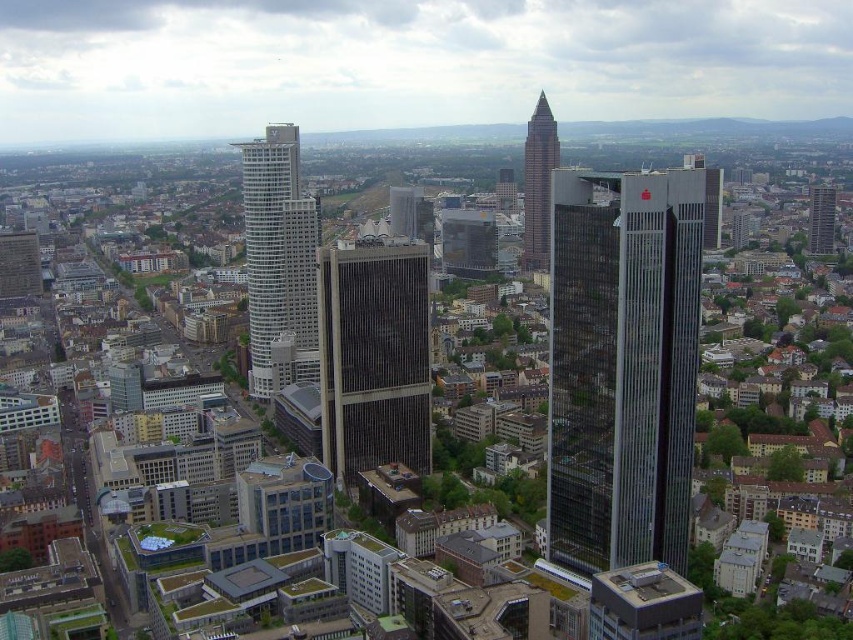
You are a drone operator tasked with flying a drone from the dark gray glass skyscraper at center to the gray glass skyscraper at upper right. Given that your drone has a maximum flight range of 1,200 feet, will it be able to reach its destination without needing to recharge?

The distance between the dark gray glass skyscraper at center and the gray glass skyscraper at upper right is 1325.74 feet, which exceeds the drone operator drone maximum flight range of 1,200 feet. Therefore, the drone will not be able to reach the gray glass skyscraper at upper right without recharging.